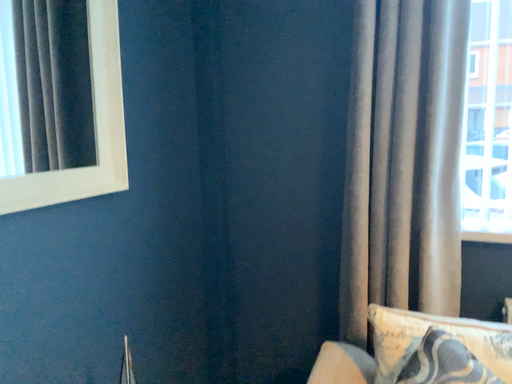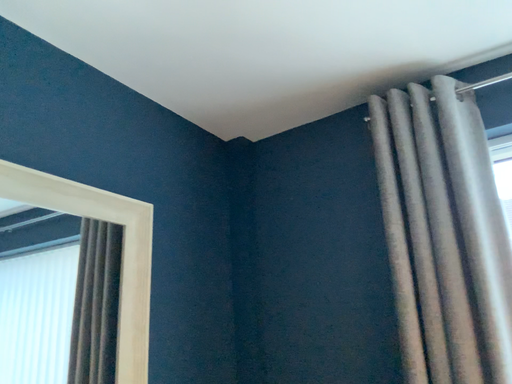
Question: Which way did the camera rotate in the video?

Choices:
 (A) rotated upward
 (B) rotated downward

Answer: (A)